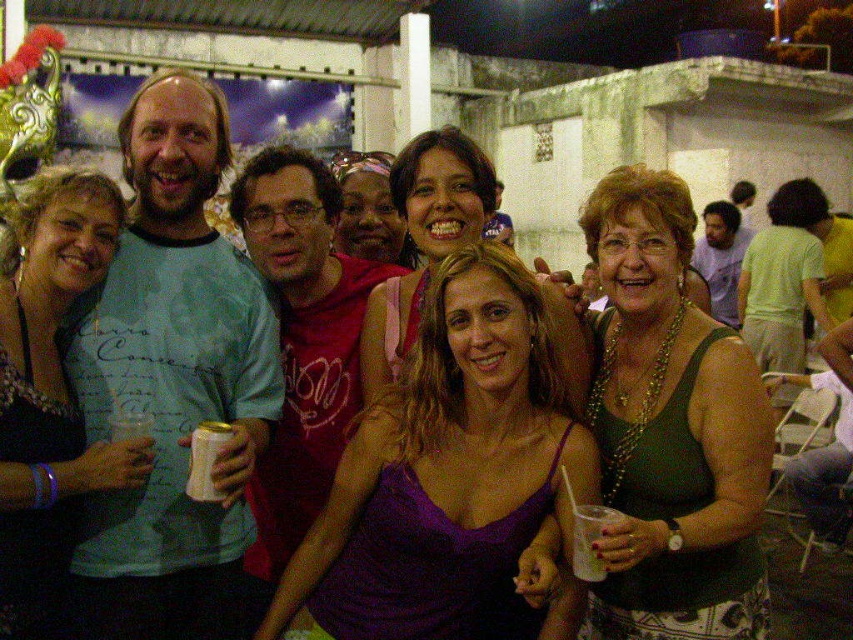
Is purple fabric tank top at center to the left of matte black dress at center from the viewer's perspective?

No, purple fabric tank top at center is not to the left of matte black dress at center.

Is purple fabric tank top at center thinner than matte black dress at center?

No, purple fabric tank top at center is not thinner than matte black dress at center.

Measure the distance between purple fabric tank top at center and camera.

They are 10.32 meters apart.

Find the location of a particular element. purple fabric tank top at center is located at coordinates (445, 468).

Which is in front, point (62, 381) or point (578, 394)?

Point (62, 381) is in front.

Is matte black dress at center smaller than purple satin tank top at center?

Indeed, matte black dress at center has a smaller size compared to purple satin tank top at center.

Locate an element on the screen. The image size is (853, 640). matte black dress at center is located at coordinates (50, 394).

You are a GUI agent. You are given a task and a screenshot of the screen. Output one action in this format:
    pyautogui.click(x=<x>, y=<y>)
    Task: Click on the matte black dress at center
    This screenshot has height=640, width=853.
    Given the screenshot: What is the action you would take?
    pyautogui.click(x=50, y=394)

Where is `light blue t-shirt at center`? This screenshot has width=853, height=640. light blue t-shirt at center is located at coordinates (172, 380).

This screenshot has height=640, width=853. What do you see at coordinates (172, 380) in the screenshot?
I see `light blue t-shirt at center` at bounding box center [172, 380].

Between point (189, 362) and point (62, 618), which one is positioned behind?

Positioned behind is point (189, 362).

This screenshot has height=640, width=853. Identify the location of light blue t-shirt at center. (172, 380).